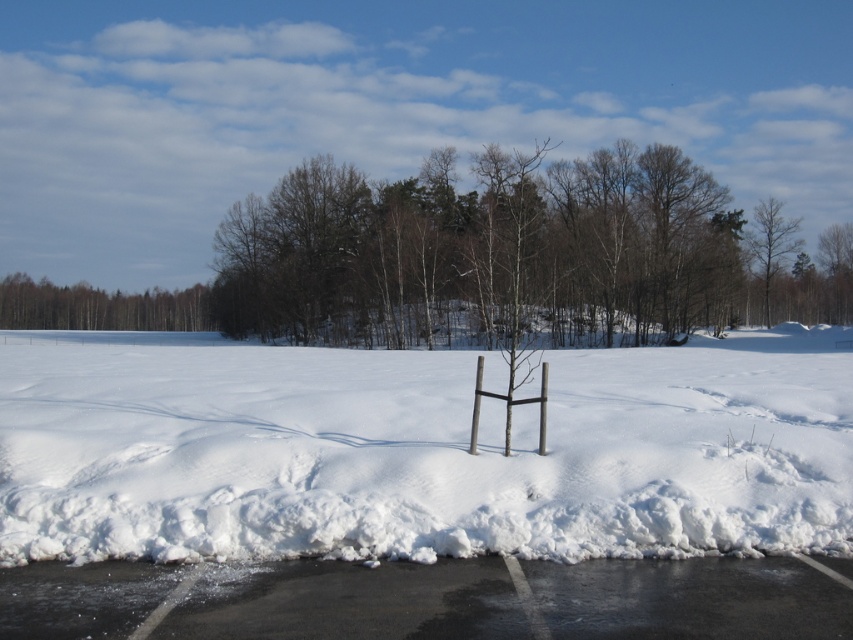
Based on the photo, is brown wood tree at upper left wider than bare wood tree at upper right?

Correct, the width of brown wood tree at upper left exceeds that of bare wood tree at upper right.

Which is behind, point (57, 292) or point (776, 250)?

Point (57, 292)

This screenshot has width=853, height=640. What do you see at coordinates (99, 307) in the screenshot?
I see `brown wood tree at upper left` at bounding box center [99, 307].

Identify the location of brown wood tree at upper left. (99, 307).

Does black asphalt parking lot at lower center appear on the left side of brown wood tree at upper left?

Incorrect, black asphalt parking lot at lower center is not on the left side of brown wood tree at upper left.

How far apart are black asphalt parking lot at lower center and brown wood tree at upper left?

black asphalt parking lot at lower center is 297.18 feet away from brown wood tree at upper left.

Describe the element at coordinates (431, 600) in the screenshot. This screenshot has height=640, width=853. I see `black asphalt parking lot at lower center` at that location.

Identify the location of black asphalt parking lot at lower center. (431, 600).

Is black asphalt parking lot at lower center wider than bare wood tree at upper right?

In fact, black asphalt parking lot at lower center might be narrower than bare wood tree at upper right.

Does point (665, 637) come in front of point (788, 227)?

That is True.

In order to click on black asphalt parking lot at lower center in this screenshot , I will do `click(431, 600)`.